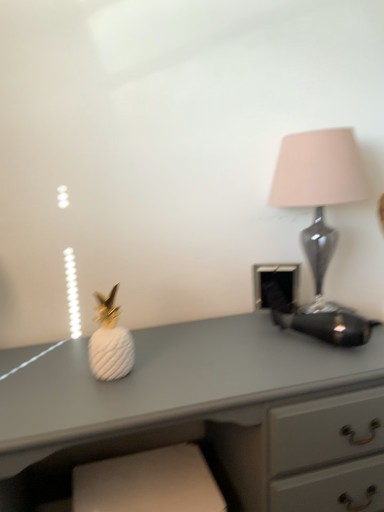
Locate an element on the screen. The image size is (384, 512). vacant space that's between white matte pineapple at center and matte glass lamp at right is located at coordinates (208, 347).